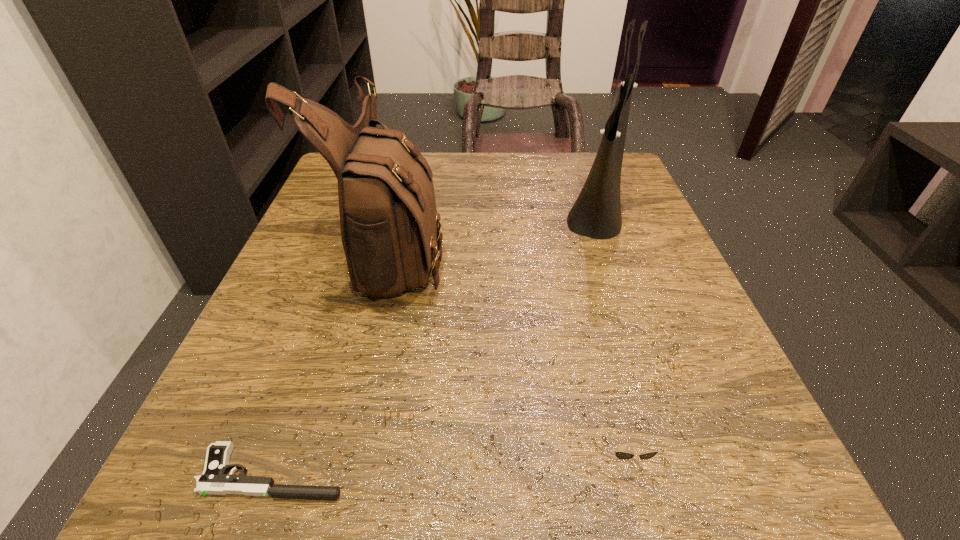
Where is `vacant space at the far right corner`? The height and width of the screenshot is (540, 960). vacant space at the far right corner is located at coordinates (621, 205).

Where is `vacant space in between the left shoulder bag and the right shoulder bag`? The image size is (960, 540). vacant space in between the left shoulder bag and the right shoulder bag is located at coordinates (495, 229).

Find the location of a particular element. This screenshot has width=960, height=540. free space between the left shoulder bag and the pistol is located at coordinates (334, 362).

The width and height of the screenshot is (960, 540). Find the location of `free point between the pistol and the third tallest object`. free point between the pistol and the third tallest object is located at coordinates (448, 463).

Identify the location of free space between the right shoulder bag and the sunglasses. (610, 330).

Identify the location of free spot between the right shoulder bag and the left shoulder bag. (495, 229).

Where is `vacant space that is in between the right shoulder bag and the sunglasses`? This screenshot has height=540, width=960. vacant space that is in between the right shoulder bag and the sunglasses is located at coordinates (610, 330).

Find the location of a particular element. blank region between the sunglasses and the right shoulder bag is located at coordinates (610, 330).

At what (x,y) coordinates should I click in order to perform the action: click on free spot between the left shoulder bag and the shortest object. Please return your answer as a coordinate pair (x, y). Looking at the image, I should click on (334, 362).

Locate an element on the screen. Image resolution: width=960 pixels, height=540 pixels. free space between the left shoulder bag and the shortest object is located at coordinates (334, 362).